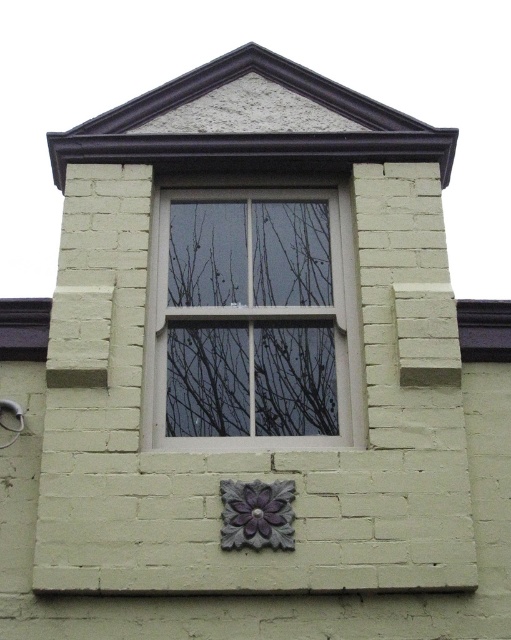
You are an architect designing a new building and want to ensure the white wood window at center and the purple matte flower at lower center are proportionate. Which object has a greater width according to the scene?

The white wood window at center has a greater width than the purple matte flower at lower center.

You are standing directly in front of the building wall. Where is the white wood window at center located relative to your viewpoint?

The white wood window at center is located at point (252, 316) relative to your viewpoint.